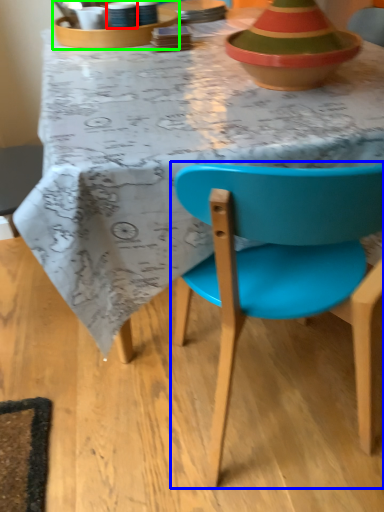
Question: Based on their relative distances, which object is farther from tableware (highlighted by a red box)? Choose from chair (highlighted by a blue box) and tableware (highlighted by a green box).

Choices:
 (A) chair
 (B) tableware

Answer: (A)